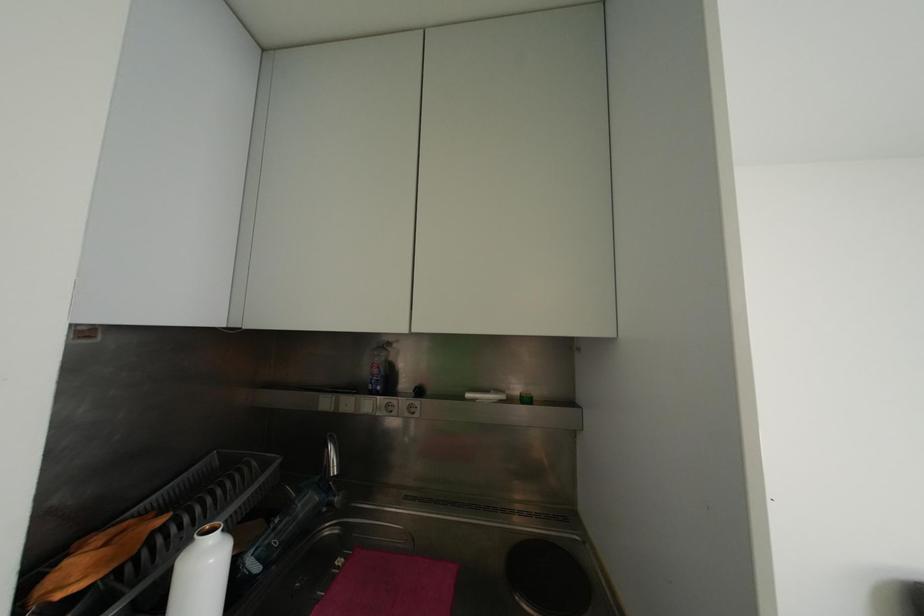
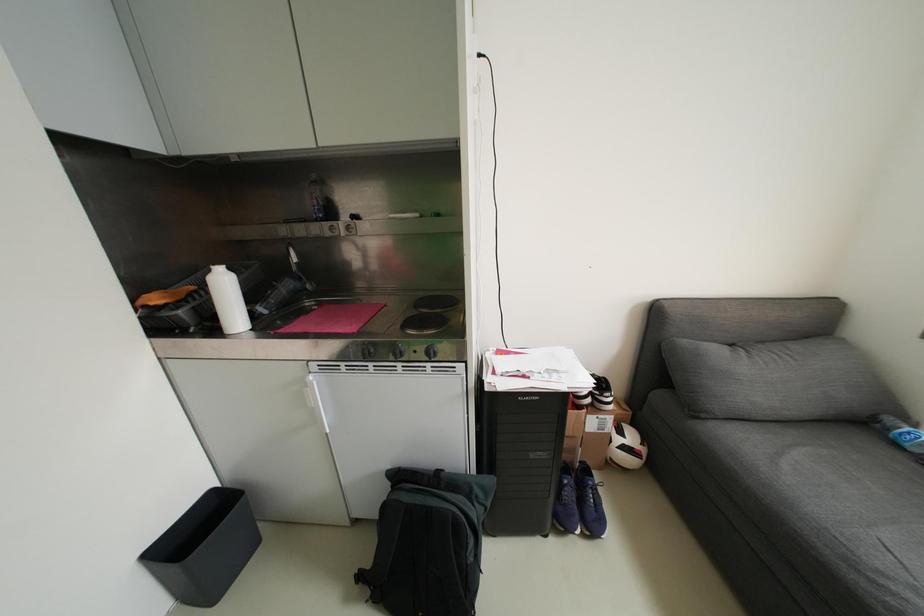
Which direction would the cameraman need to move to produce the second image?

The cameraman walked toward right, backward.